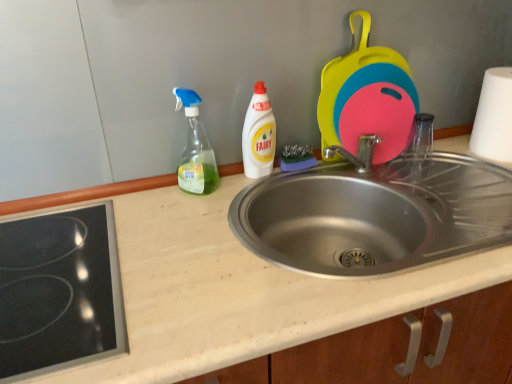
Locate an element on the screen. The width and height of the screenshot is (512, 384). free spot above beige laminate counter top at center (from a real-world perspective) is located at coordinates (233, 245).